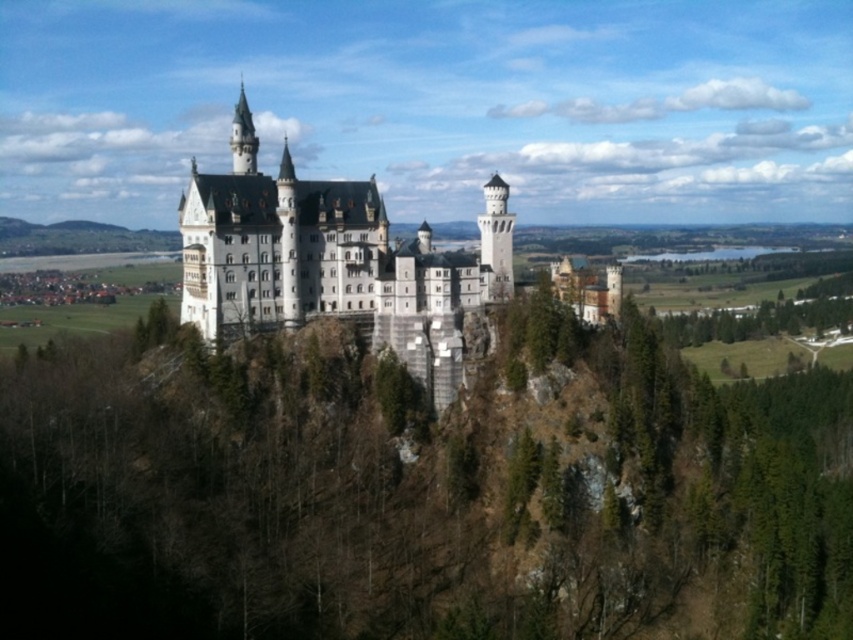
You are standing at the point marked as point (416, 493) in the image of Neuschwanstein Castle. Looking towards the castle, which direction should you walk to find the green leafy trees at center?

The green leafy trees at center are located at point (416, 493), so you are already standing among them.

You are a tour guide leading a group to the white stone castle at center. You want to ensure that the group can hear you clearly. Considering the green leafy trees at center are between you and the castle, what is the maximum distance in meters that the group can be from you while still hearing you clearly?

The distance between the green leafy trees at center and the white stone castle at center is 18.20 meters. To ensure the group can hear you clearly, they should stay within 18.20 meters of you, as beyond that distance, the trees might obstruct your voice.

You are a tourist visiting Neuschwanstein Castle and want to take a photo that includes both the green leafy trees at center and the white stone castle at center. Which object will appear bigger in your photo?

The green leafy trees at center will appear bigger in the photo since they have a larger size compared to the white stone castle at center.